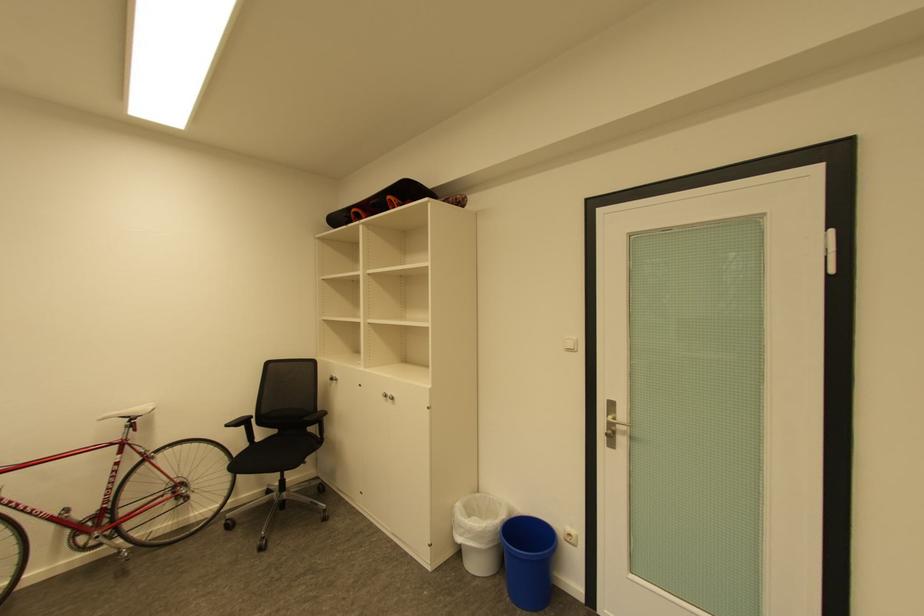
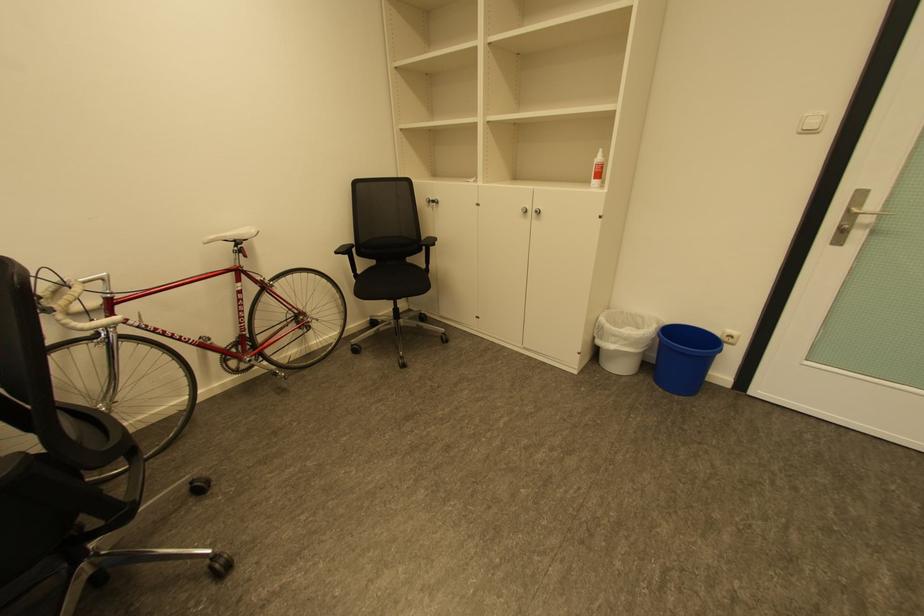
Where in the second image is the point corresponding to point (235, 426) from the first image?

(344, 253)